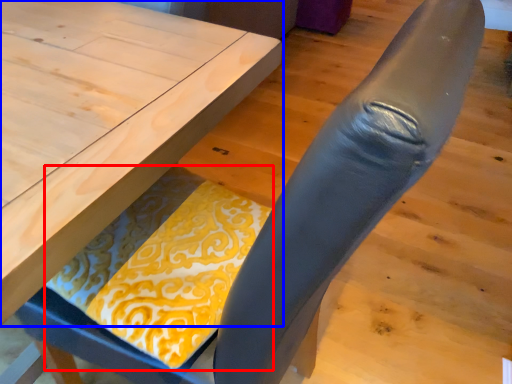
Question: Which object appears closest to the camera in this image, blanket (highlighted by a red box) or table (highlighted by a blue box)?

Choices:
 (A) blanket
 (B) table

Answer: (B)